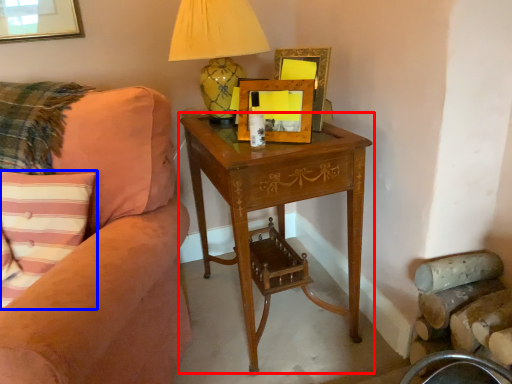
Question: Which point is further to the camera, nightstand (highlighted by a red box) or pillow (highlighted by a blue box)?

Choices:
 (A) nightstand
 (B) pillow

Answer: (A)